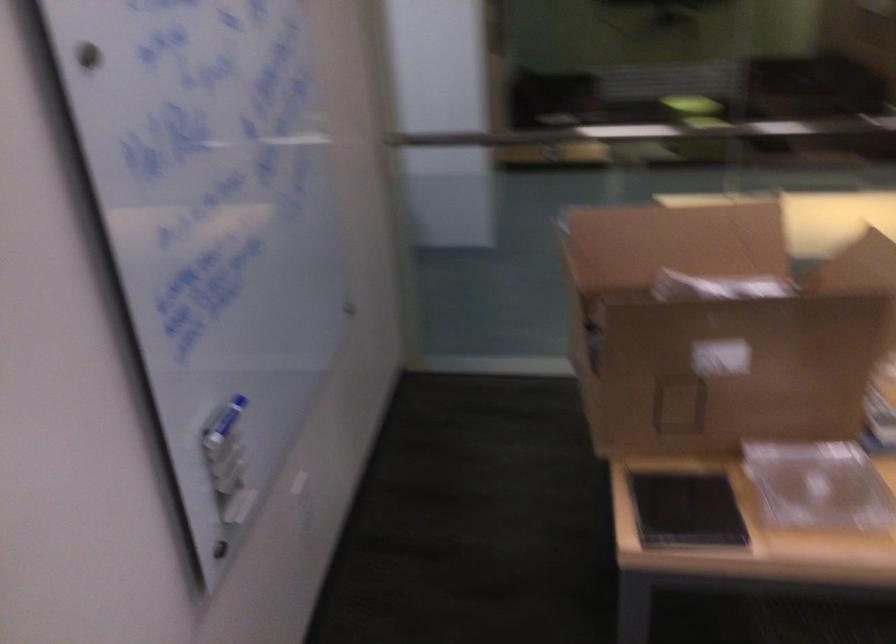
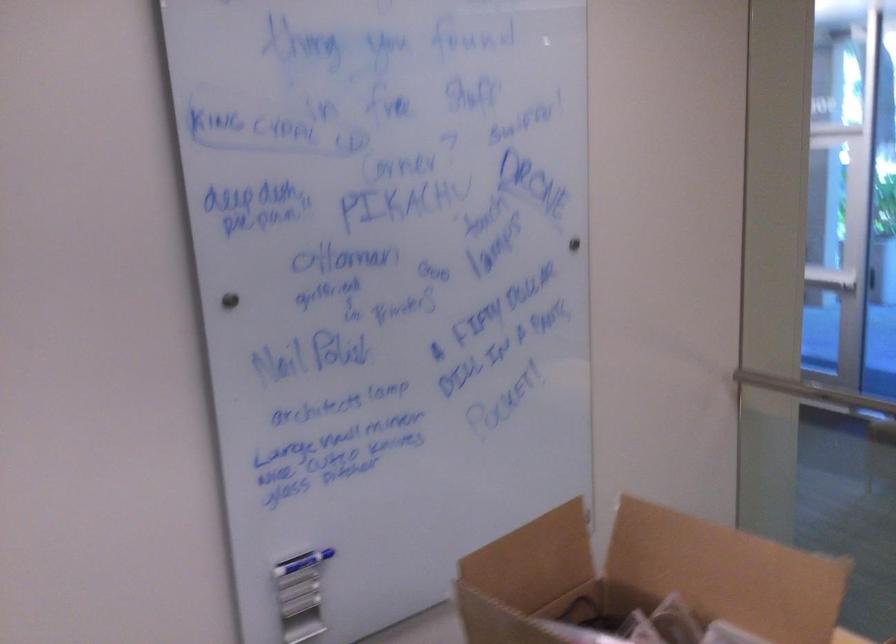
In the second image, find the point that corresponds to point 564,263 in the first image.

(536, 547)